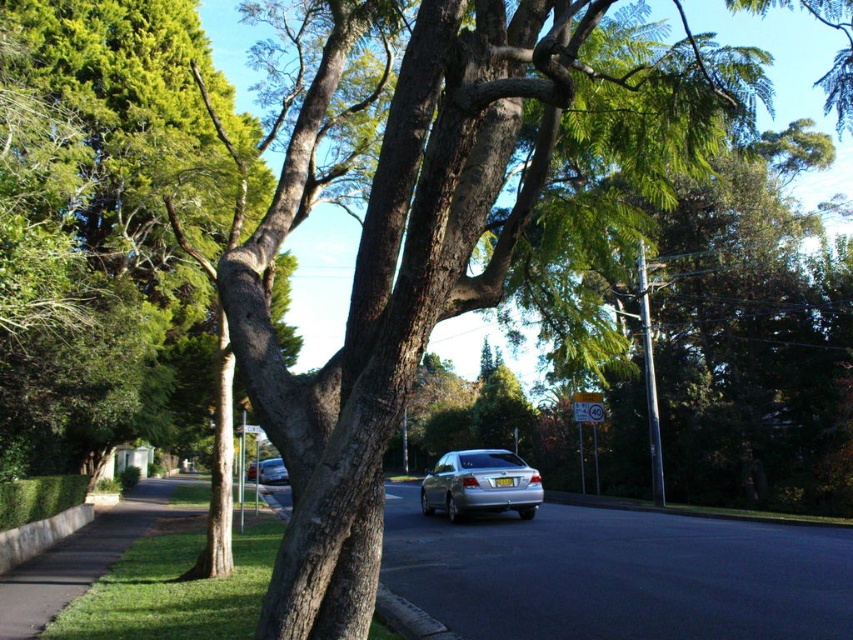
You are standing at the point marked by the coordinates point (618, 573) in the image. What type of surface are you currently standing on?

The point (618, 573) indicates gray asphalt road at center, so you are standing on a gray asphalt road.

You are standing at the edge of the gray concrete curb at lower center and want to walk towards the gray asphalt road at center. Which direction should you move to reach the road?

Since the gray asphalt road at center is closer to the viewer than the gray concrete curb at lower center, you should move forward towards the road as it is nearer to your current position.

You are standing at the edge of the suburban street scene. You need to cross the gray asphalt road at center to reach the large tree with sprawling branches. Which direction should you walk to get to the road first?

The gray asphalt road at center is located at point (618, 573), so you should walk towards the center of the scene to reach the road first before heading towards the tree.